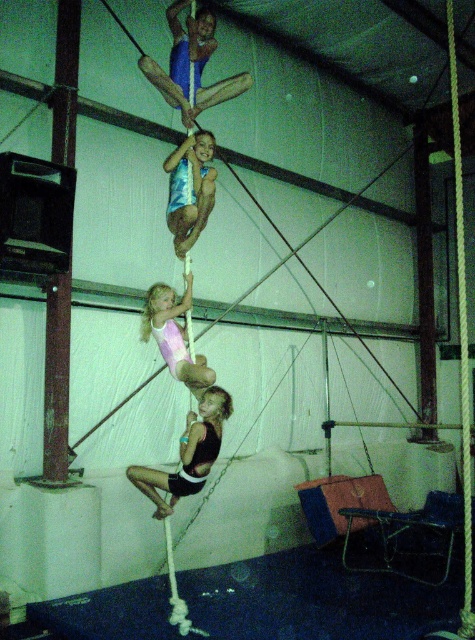
Question: Is black fabric shorts at center to the left of pink leotard at center from the viewer's perspective?

Choices:
 (A) yes
 (B) no

Answer: (A)

Question: Which object appears farthest from the camera in this image?

Choices:
 (A) pink leotard at center
 (B) shiny blue leotard at center

Answer: (B)

Question: Which point appears closest to the camera in this image?

Choices:
 (A) (171, 506)
 (B) (199, 204)

Answer: (A)

Question: Does shiny blue leotard at center come in front of pink leotard at center?

Choices:
 (A) yes
 (B) no

Answer: (B)

Question: Does black fabric shorts at center have a greater width compared to pink leotard at center?

Choices:
 (A) yes
 (B) no

Answer: (A)

Question: Which point is farther from the camera taking this photo?

Choices:
 (A) (212, 378)
 (B) (208, 186)
 (C) (189, 422)

Answer: (B)